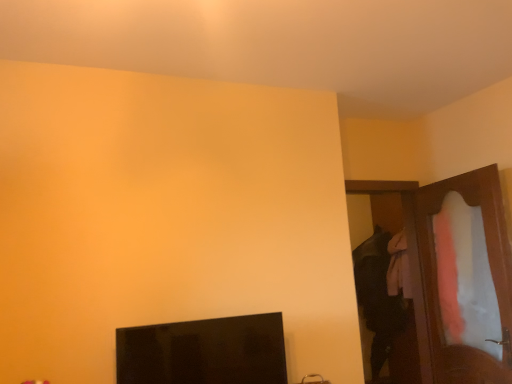
Question: From the image's perspective, is black glossy monitor at lower left positioned above or below wooden door at right?

Choices:
 (A) below
 (B) above

Answer: (A)

Question: In terms of width, does black glossy monitor at lower left look wider or thinner when compared to wooden door at right?

Choices:
 (A) wide
 (B) thin

Answer: (A)

Question: Which of these objects is positioned farthest from the black glossy monitor at lower left?

Choices:
 (A) wooden dresser at right
 (B) wooden door at right

Answer: (B)

Question: Estimate the real-world distances between objects in this image. Which object is farther from the wooden dresser at right?

Choices:
 (A) black glossy monitor at lower left
 (B) wooden door at right

Answer: (A)